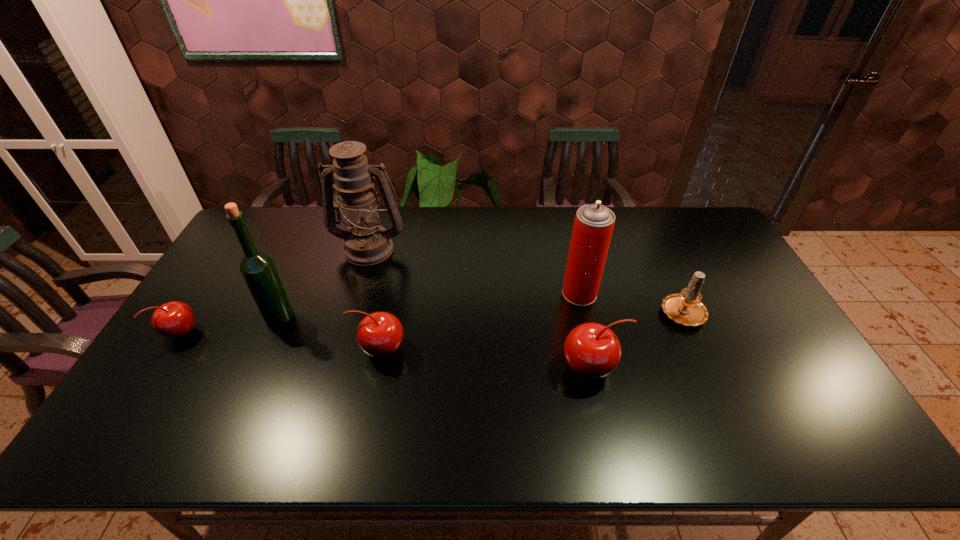
Image resolution: width=960 pixels, height=540 pixels. In order to click on free region located 0.400m on the back of the rightmost cherry in this screenshot , I will do `click(566, 254)`.

Locate an element on the screen. Image resolution: width=960 pixels, height=540 pixels. vacant space located on the front of the farthest object is located at coordinates (357, 292).

This screenshot has width=960, height=540. I want to click on vacant space situated 0.260m on the left of the rightmost object, so click(572, 312).

The height and width of the screenshot is (540, 960). Find the location of `vacant space located on the front of the fifth shortest object`. vacant space located on the front of the fifth shortest object is located at coordinates 588,334.

This screenshot has width=960, height=540. In order to click on vacant region located on the front of the second object from left to right in this screenshot , I will do `click(264, 354)`.

You are a GUI agent. You are given a task and a screenshot of the screen. Output one action in this format:
    pyautogui.click(x=<x>, y=<y>)
    Task: Click on the object at the far edge
    This screenshot has width=960, height=540.
    Given the screenshot: What is the action you would take?
    367,243

Where is `object that is at the near edge`? This screenshot has width=960, height=540. object that is at the near edge is located at coordinates (592, 351).

Locate an element on the screen. object that is at the left edge is located at coordinates (174, 319).

This screenshot has width=960, height=540. I want to click on free space at the far edge of the desktop, so click(638, 241).

What are the coordinates of `free region at the near edge of the desktop` in the screenshot? It's located at (613, 403).